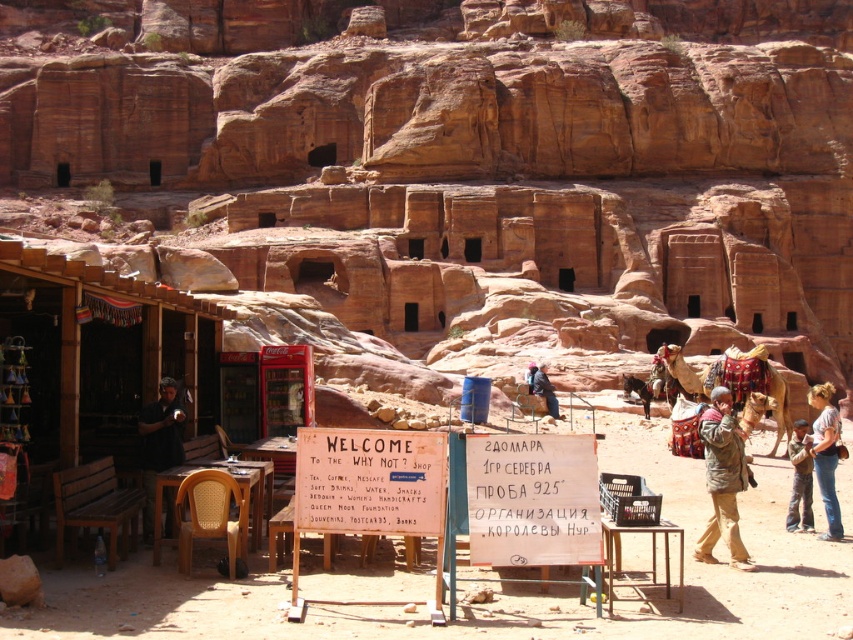
Is brown fuzzy jacket at lower right to the right of light brown hair at center from the viewer's perspective?

In fact, brown fuzzy jacket at lower right is to the left of light brown hair at center.

Does brown fuzzy jacket at lower right have a greater height compared to light brown hair at center?

Yes.

Describe the element at coordinates (722, 480) in the screenshot. This screenshot has width=853, height=640. I see `brown fuzzy jacket at lower right` at that location.

What are the coordinates of `brown fuzzy jacket at lower right` in the screenshot? It's located at (722, 480).

Consider the image. Can you confirm if wooden signboard at center is positioned to the right of white wooden sign at center?

Correct, you'll find wooden signboard at center to the right of white wooden sign at center.

Identify the location of wooden signboard at center. This screenshot has width=853, height=640. (532, 499).

At what (x,y) coordinates should I click in order to perform the action: click on wooden signboard at center. Please return your answer as a coordinate pair (x, y). The width and height of the screenshot is (853, 640). Looking at the image, I should click on (532, 499).

Is wooden hut at left bigger than wooden signboard at center?

Correct, wooden hut at left is larger in size than wooden signboard at center.

Which is behind, point (155, 396) or point (498, 461)?

Point (155, 396)

At what (x,y) coordinates should I click in order to perform the action: click on wooden hut at left. Please return your answer as a coordinate pair (x, y). The image size is (853, 640). Looking at the image, I should click on (103, 349).